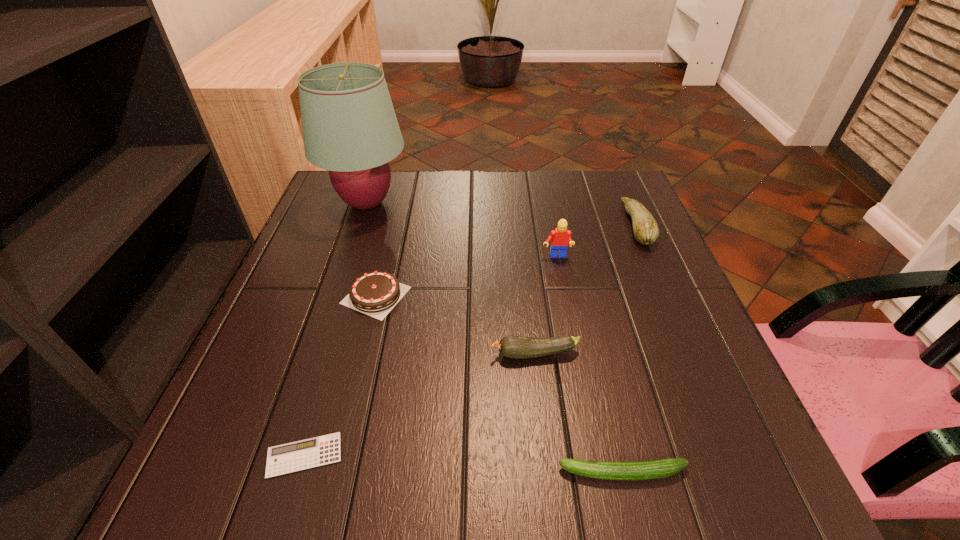
Locate an element on the screen. This screenshot has height=540, width=960. vacant point located between the Lego and the third tallest object is located at coordinates (596, 241).

You are a GUI agent. You are given a task and a screenshot of the screen. Output one action in this format:
    pyautogui.click(x=<x>, y=<y>)
    Task: Click on the vacant space that's between the lampshade and the second shortest object
    
    Given the screenshot: What is the action you would take?
    pyautogui.click(x=495, y=338)

Choose which object is the second nearest neighbor to the shortest object. Please provide its 2D coordinates. Your answer should be formatted as a tuple, i.e. [(x, y)], where the tuple contains the x and y coordinates of a point satisfying the conditions above.

[(516, 347)]

Locate an element on the screen. The height and width of the screenshot is (540, 960). object that is the second closest one to the rightmost object is located at coordinates (516, 347).

Locate which zucchini ranks second in proximity to the third shortest object. Please provide its 2D coordinates. Your answer should be formatted as a tuple, i.e. [(x, y)], where the tuple contains the x and y coordinates of a point satisfying the conditions above.

[(642, 470)]

Identify which zucchini is located as the third nearest to the shortest object. Please provide its 2D coordinates. Your answer should be formatted as a tuple, i.e. [(x, y)], where the tuple contains the x and y coordinates of a point satisfying the conditions above.

[(646, 231)]

I want to click on vacant region that satisfies the following two spatial constraints: 1. at the stem end of the farthest zucchini; 2. on the front-facing side of the third farthest object, so click(x=651, y=257).

The image size is (960, 540). In order to click on blank area in the image that satisfies the following two spatial constraints: 1. at the stem end of the rightmost zucchini; 2. on the front side of the fourth farthest object in this screenshot , I will do `click(667, 295)`.